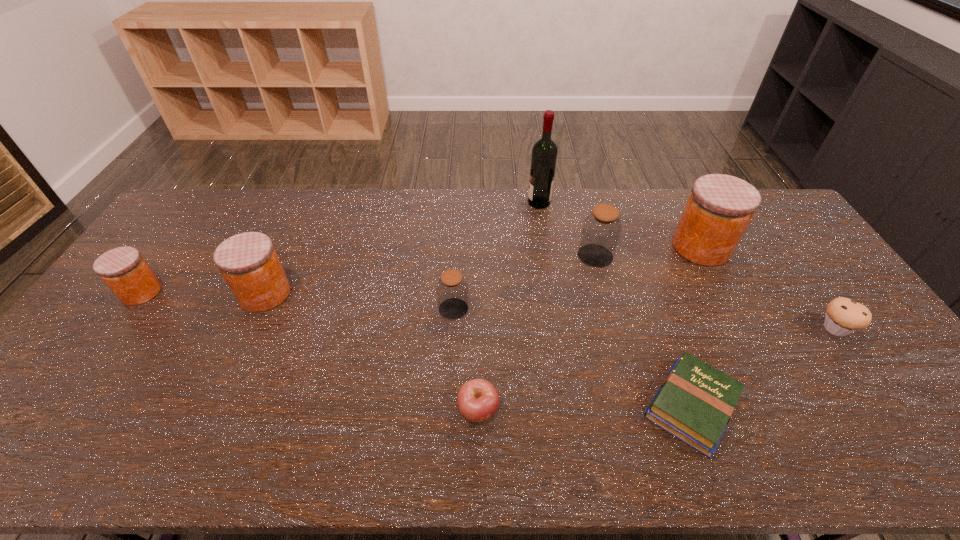
Where is `free space between the smallest orange jar and the farther brown jar`? The image size is (960, 540). free space between the smallest orange jar and the farther brown jar is located at coordinates (369, 274).

Locate an element on the screen. The image size is (960, 540). free space that is in between the right brown jar and the apple is located at coordinates (537, 333).

Where is `empty space that is in between the rightmost jar and the brown book`? empty space that is in between the rightmost jar and the brown book is located at coordinates (696, 326).

The image size is (960, 540). Identify the location of vacant area that lies between the eighth object from right to left and the fifth object from right to left. (402, 248).

Identify the location of vacant space in between the book and the leftmost object. This screenshot has width=960, height=540. (417, 349).

Locate an element on the screen. Image resolution: width=960 pixels, height=540 pixels. the closest object to the smaller brown jar is located at coordinates (478, 400).

Identify the location of object that stands as the sixth closest to the book. coord(544,153).

Identify which jar is the second nearest to the third jar from left to right. Please provide its 2D coordinates. Your answer should be formatted as a tuple, i.e. [(x, y)], where the tuple contains the x and y coordinates of a point satisfying the conditions above.

[(248, 261)]

Identify the location of jar that is the second closest to the leftmost jar. The height and width of the screenshot is (540, 960). (452, 290).

Locate which orange jar is the second closest to the eighth object from right to left. Please provide its 2D coordinates. Your answer should be formatted as a tuple, i.e. [(x, y)], where the tuple contains the x and y coordinates of a point satisfying the conditions above.

[(720, 207)]